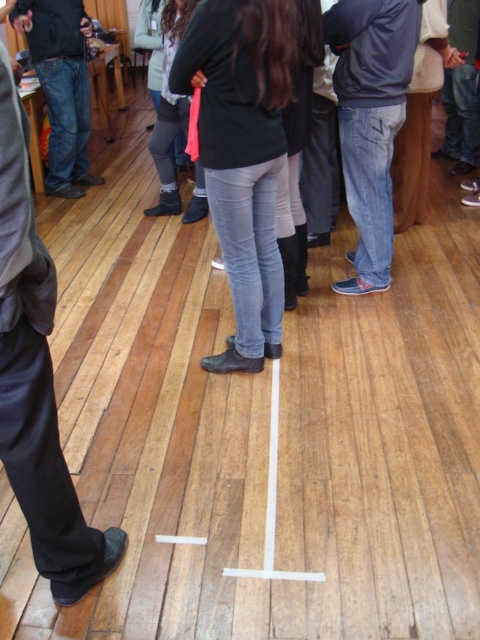
Can you confirm if black leather pants at left is bigger than jeans at center?

No.

Who is lower down, black leather pants at left or jeans at center?

black leather pants at left is lower down.

You are a GUI agent. You are given a task and a screenshot of the screen. Output one action in this format:
    pyautogui.click(x=<x>, y=<y>)
    Task: Click on the black leather pants at left
    
    Given the screenshot: What is the action you would take?
    pyautogui.click(x=36, y=380)

The width and height of the screenshot is (480, 640). Identify the location of black leather pants at left. (36, 380).

Can you confirm if black leather pants at left is positioned above denim jeans at left?

Actually, black leather pants at left is below denim jeans at left.

Who is more distant from viewer, (19, 220) or (73, 138)?

Positioned behind is point (73, 138).

Where is `black leather pants at left`? black leather pants at left is located at coordinates (36, 380).

Between jeans at center and denim jeans at left, which one appears on the right side from the viewer's perspective?

jeans at center is more to the right.

Is jeans at center taller than denim jeans at left?

No, jeans at center is not taller than denim jeans at left.

Between point (345, 60) and point (24, 8), which one is positioned in front?

Positioned in front is point (345, 60).

Where is `jeans at center`? jeans at center is located at coordinates (371, 120).